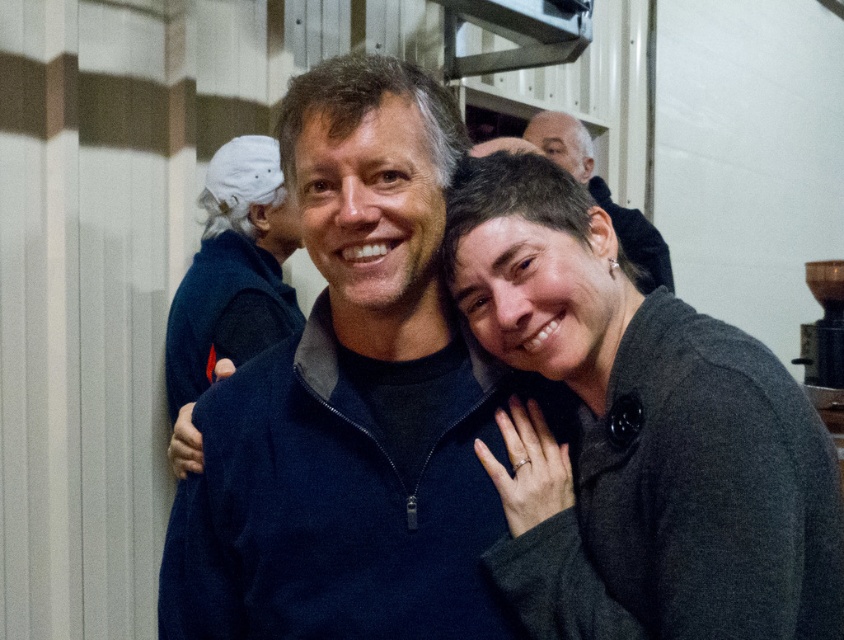
Question: Which object is the farthest from the dark blue fleece at center?

Choices:
 (A) matte black sweater at center
 (B) gray woolen sweater at center

Answer: (A)

Question: Which object is closer to the camera taking this photo?

Choices:
 (A) gray woolen sweater at center
 (B) dark blue fleece at center
 (C) matte black sweater at center

Answer: (A)

Question: Which point is farther to the camera?

Choices:
 (A) dark blue fleece at center
 (B) matte black sweater at center
 (C) gray woolen sweater at center

Answer: (B)

Question: Is dark blue fleece at center in front of matte black sweater at center?

Choices:
 (A) no
 (B) yes

Answer: (B)

Question: Can you confirm if dark blue fleece at center is positioned above gray woolen sweater at center?

Choices:
 (A) no
 (B) yes

Answer: (A)

Question: In this image, where is gray woolen sweater at center located relative to matte black sweater at center?

Choices:
 (A) below
 (B) above

Answer: (A)